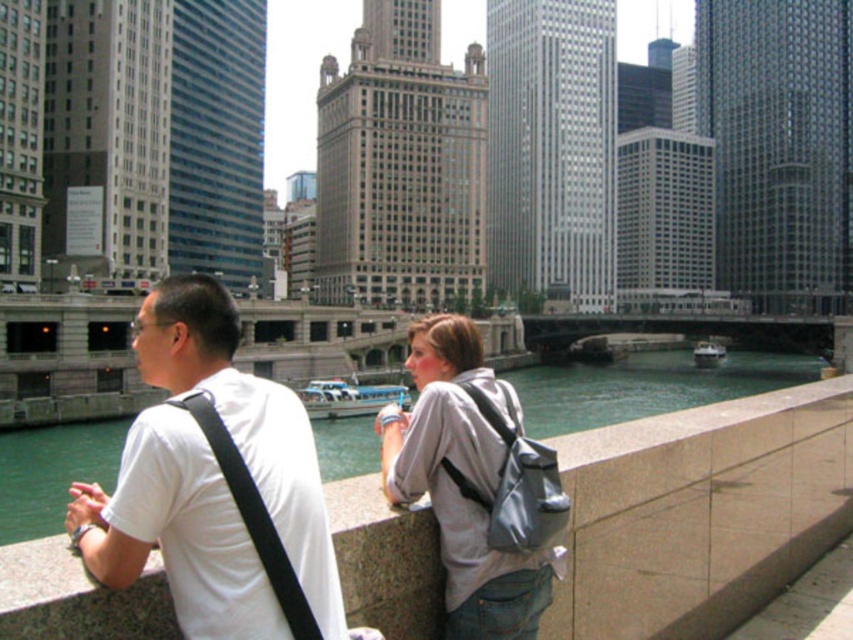
Is smooth concrete ledge at center wider than gray fabric backpack at center?

Indeed, smooth concrete ledge at center has a greater width compared to gray fabric backpack at center.

Who is more forward, (x=775, y=413) or (x=465, y=616)?

Positioned in front is point (x=465, y=616).

The width and height of the screenshot is (853, 640). Identify the location of smooth concrete ledge at center. (700, 512).

Can you confirm if white matte shirt at center is thinner than gray fabric backpack at center?

No.

Is white matte shirt at center bigger than gray fabric backpack at center?

Yes.

Is point (215, 484) positioned behind point (450, 614)?

No, it is in front of (450, 614).

At what (x,y) coordinates should I click in order to perform the action: click on white matte shirt at center. Please return your answer as a coordinate pair (x, y). Image resolution: width=853 pixels, height=640 pixels. Looking at the image, I should click on (177, 531).

Is smooth concrete ledge at center thinner than white matte shirt at center?

Incorrect, smooth concrete ledge at center's width is not less than white matte shirt at center's.

Which is below, smooth concrete ledge at center or white matte shirt at center?

smooth concrete ledge at center is lower down.

Based on the photo, who is more forward, (705, 486) or (282, 477)?

Point (282, 477) is in front.

This screenshot has height=640, width=853. I want to click on smooth concrete ledge at center, so click(x=700, y=512).